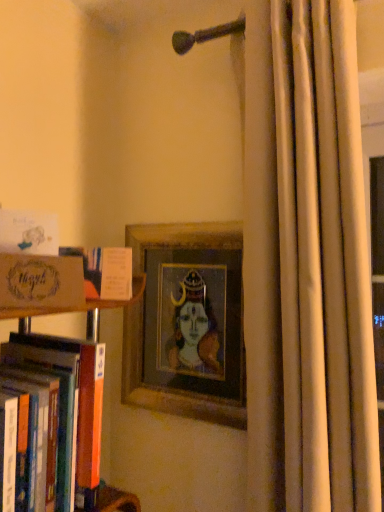
Question: Is point (99, 293) closer or farther from the camera than point (193, 286)?

Choices:
 (A) closer
 (B) farther

Answer: (A)

Question: In terms of height, does orange cardboard book at left, acting as the second book starting from the bottom, look taller or shorter compared to wooden picture frame at center?

Choices:
 (A) tall
 (B) short

Answer: (B)

Question: Estimate the real-world distances between objects in this image. Which object is farther from the orange cardboard book at left, acting as the second book starting from the bottom?

Choices:
 (A) beige fabric curtain at right
 (B) matte paper card at left, the 1th book when ordered from top to bottom
 (C) wooden picture frame at center
 (D) orange hardcover book at left, placed as the first book when sorted from bottom to top
 (E) matte cardboard box at left

Answer: (A)

Question: Considering the real-world distances, which object is farthest from the orange hardcover book at left, the 3th book when ordered from top to bottom?

Choices:
 (A) beige fabric curtain at right
 (B) matte paper card at left, marked as the third book in a bottom-to-top arrangement
 (C) matte cardboard box at left
 (D) wooden picture frame at center
 (E) orange cardboard book at left, which ranks as the second book in top-to-bottom order

Answer: (A)